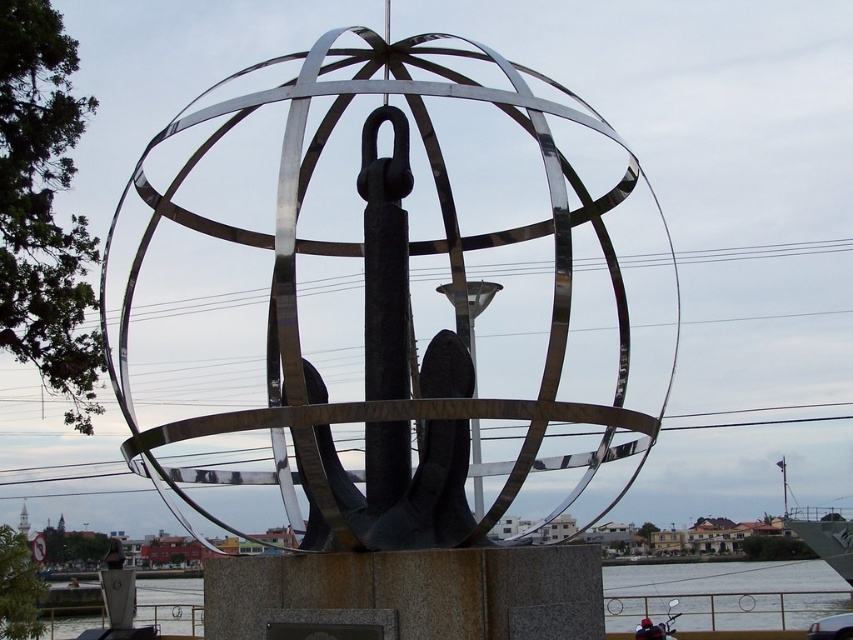
Question: Does polished metal sphere at center have a greater width compared to transparent water at lower center?

Choices:
 (A) yes
 (B) no

Answer: (B)

Question: Is the position of polished metal sphere at center more distant than that of transparent water at lower center?

Choices:
 (A) yes
 (B) no

Answer: (B)

Question: In this image, where is polished metal sphere at center located relative to transparent water at lower center?

Choices:
 (A) below
 (B) above

Answer: (B)